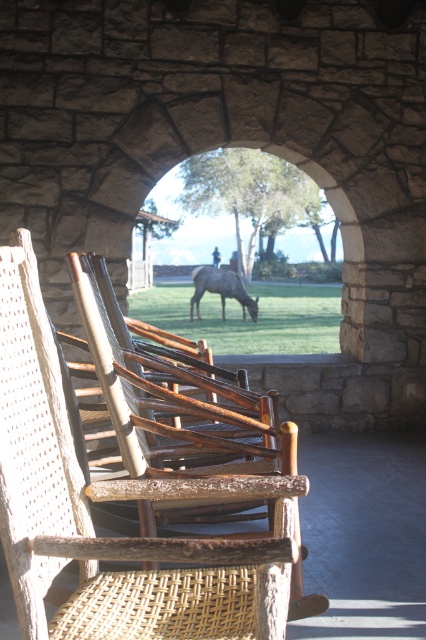
Can you confirm if woven wood beach chair at center is taller than brown textured horse at center?

Yes.

Is woven wood beach chair at center further to the viewer compared to brown textured horse at center?

No, it is in front of brown textured horse at center.

Between point (259, 552) and point (206, 282), which one is positioned in front?

Positioned in front is point (259, 552).

Locate an element on the screen. woven wood beach chair at center is located at coordinates pyautogui.click(x=135, y=480).